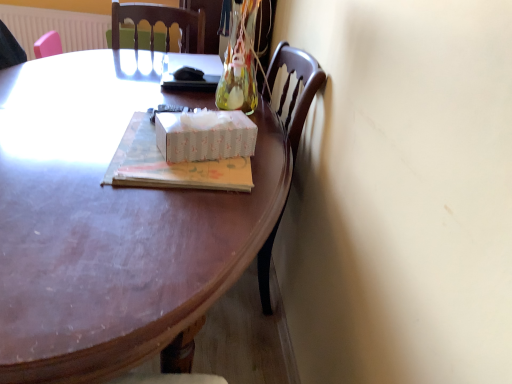
What is the approximate height of white plastic radiator at upper left?

white plastic radiator at upper left is 14.95 inches in height.

Locate an element on the screen. The image size is (512, 384). matte cardboard book at center is located at coordinates (170, 165).

Is wooden desk at center located outside matte cardboard book at center?

Indeed, wooden desk at center is completely outside matte cardboard book at center.

Who is taller, wooden desk at center or matte cardboard book at center?

Standing taller between the two is wooden desk at center.

Between wooden desk at center and matte cardboard book at center, which one has smaller width?

matte cardboard book at center.

From the picture: Are wooden desk at center and matte cardboard book at center beside each other?

No, wooden desk at center is not with matte cardboard book at center.

Which of these two, matte cardboard book at center or white paper tissue box at center, is smaller?

With smaller size is white paper tissue box at center.

Which point is more distant from viewer, (239, 162) or (209, 153)?

Positioned behind is point (239, 162).

Is matte cardboard book at center aimed at white paper tissue box at center?

No.

Is white paper tissue box at center inside the boundaries of matte cardboard book at center, or outside?

The correct answer is: outside.

Which point is more forward, (228, 118) or (249, 185)?

The point (249, 185) is more forward.

Looking at their sizes, would you say white paper tissue box at center is wider or thinner than matte cardboard book at center?

In the image, white paper tissue box at center appears to be more narrow than matte cardboard book at center.

Considering the positions of point (8, 23) and point (27, 375), is point (8, 23) closer or farther from the camera than point (27, 375)?

Clearly, point (8, 23) is more distant from the camera than point (27, 375).

Does white plastic radiator at upper left turn towards wooden desk at center?

Yes.

Is white plastic radiator at upper left taller than wooden desk at center?

Incorrect, the height of white plastic radiator at upper left is not larger of that of wooden desk at center.

The image size is (512, 384). What are the coordinates of `radiator that appears above the wooden desk at center (from a real-world perspective)` in the screenshot? It's located at (56, 27).

Is matte cardboard book at center not close to wooden desk at center?

No.

Which object is further away from the camera taking this photo, matte cardboard book at center or wooden desk at center?

matte cardboard book at center is further from the camera.

Is matte cardboard book at center facing away from wooden desk at center?

That's not correct — matte cardboard book at center is not looking away from wooden desk at center.

Can you confirm if matte cardboard book at center is thinner than wooden desk at center?

Yes, matte cardboard book at center is thinner than wooden desk at center.

Is white plastic radiator at upper left oriented away from matte cardboard book at center?

No.

How far apart are white plastic radiator at upper left and matte cardboard book at center?

The distance of white plastic radiator at upper left from matte cardboard book at center is 1.94 meters.

How different are the orientations of white plastic radiator at upper left and matte cardboard book at center in degrees?

The facing directions of white plastic radiator at upper left and matte cardboard book at center are 92.9 degrees apart.

Does white plastic radiator at upper left lie behind matte cardboard book at center?

Yes, it is.

Is white paper tissue box at center not close to white plastic radiator at upper left?

Yes.

Is white paper tissue box at center oriented away from white plastic radiator at upper left?

No.

Is white paper tissue box at center completely or partially outside of white plastic radiator at upper left?

white paper tissue box at center lies outside white plastic radiator at upper left's area.

Which is in front, white paper tissue box at center or white plastic radiator at upper left?

Positioned in front is white paper tissue box at center.

Locate an element on the screen. The image size is (512, 384). book to the right of wooden desk at center is located at coordinates (170, 165).

The image size is (512, 384). In order to click on box that appears above the matte cardboard book at center (from the image's perspective) in this screenshot , I will do point(204,135).

Looking at the image, which one is located closer to white paper tissue box at center, wooden desk at center or white plastic radiator at upper left?

Among the two, wooden desk at center is located nearer to white paper tissue box at center.

Based on their spatial positions, is white plastic radiator at upper left or wooden desk at center closer to white paper tissue box at center?

wooden desk at center.

Looking at the image, which one is located further to matte cardboard book at center, white paper tissue box at center or white plastic radiator at upper left?

The object further to matte cardboard book at center is white plastic radiator at upper left.

Considering their positions, is white plastic radiator at upper left positioned closer to wooden desk at center than matte cardboard book at center?

matte cardboard book at center.

Which object lies further to the anchor point white plastic radiator at upper left, wooden desk at center or matte cardboard book at center?

matte cardboard book at center is positioned further to the anchor white plastic radiator at upper left.

When comparing their distances from wooden desk at center, does white plastic radiator at upper left or white paper tissue box at center seem further?

The object further to wooden desk at center is white plastic radiator at upper left.

Which object lies further to the anchor point white paper tissue box at center, wooden desk at center or matte cardboard book at center?

wooden desk at center lies further to white paper tissue box at center than the other object.

Which object lies nearer to the anchor point white paper tissue box at center, matte cardboard book at center or wooden desk at center?

Among the two, matte cardboard book at center is located nearer to white paper tissue box at center.

Where is `box located between matte cardboard book at center and white plastic radiator at upper left in the depth direction`? This screenshot has height=384, width=512. box located between matte cardboard book at center and white plastic radiator at upper left in the depth direction is located at coordinates (204, 135).

You are a GUI agent. You are given a task and a screenshot of the screen. Output one action in this format:
    pyautogui.click(x=<x>, y=<y>)
    Task: Click on the box located between wooden desk at center and white plastic radiator at upper left in the depth direction
    
    Given the screenshot: What is the action you would take?
    pyautogui.click(x=204, y=135)

Find the location of `book located between wooden desk at center and white plastic radiator at upper left in the depth direction`. book located between wooden desk at center and white plastic radiator at upper left in the depth direction is located at coordinates (170, 165).

At what (x,y) coordinates should I click in order to perform the action: click on book positioned between wooden desk at center and white paper tissue box at center from near to far. Please return your answer as a coordinate pair (x, y). The width and height of the screenshot is (512, 384). Looking at the image, I should click on (170, 165).